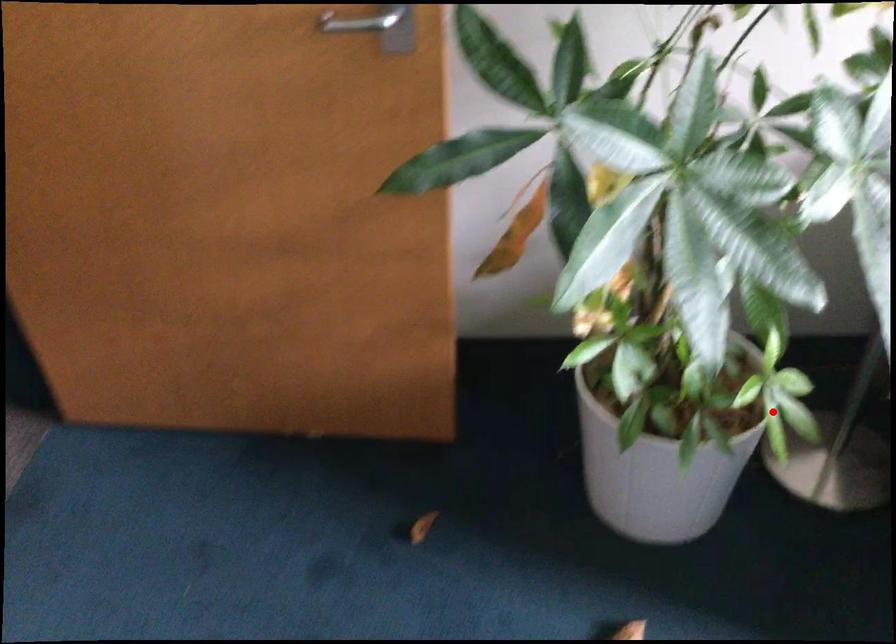
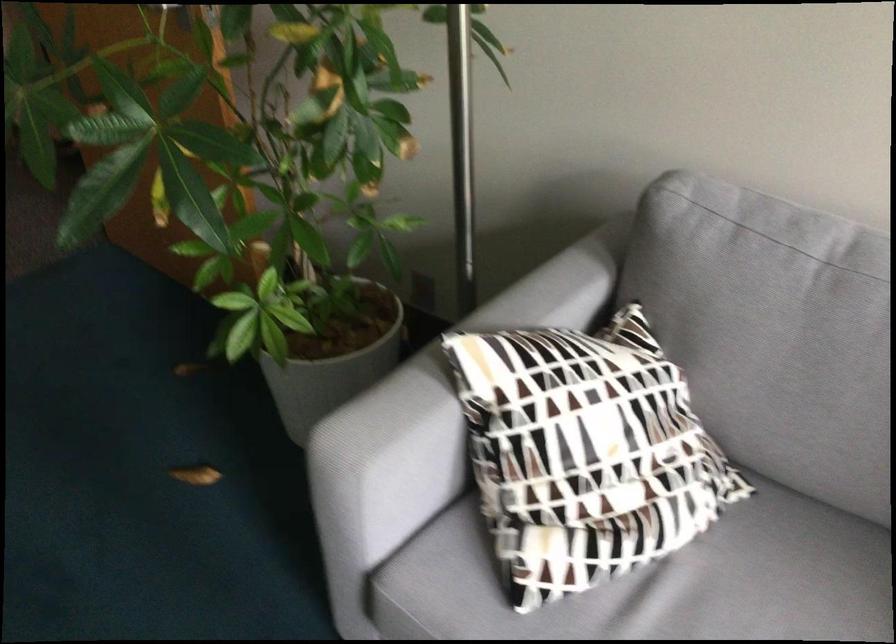
Question: I am providing you with two images of the same scene from different viewpoints. Given a red point in image1, look at the same physical point in image2. Is it:

Choices:
 (A) Closer to the viewpoint
 (B) Farther from the viewpoint

Answer: (B)